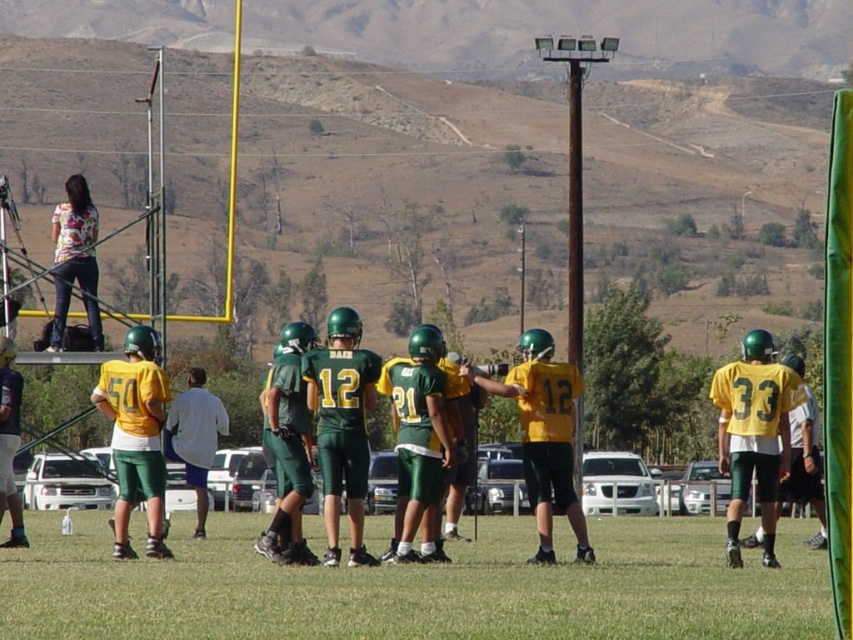
Between green grass at lower center and white fabric shirt at center, which one has more height?

With more height is white fabric shirt at center.

Between green grass at lower center and white fabric shirt at center, which one appears on the left side from the viewer's perspective?

Positioned to the left is white fabric shirt at center.

Which is in front, point (614, 552) or point (207, 416)?

Point (614, 552) is more forward.

You are a GUI agent. You are given a task and a screenshot of the screen. Output one action in this format:
    pyautogui.click(x=<x>, y=<y>)
    Task: Click on the green grass at lower center
    The image size is (853, 640).
    Given the screenshot: What is the action you would take?
    pyautogui.click(x=416, y=588)